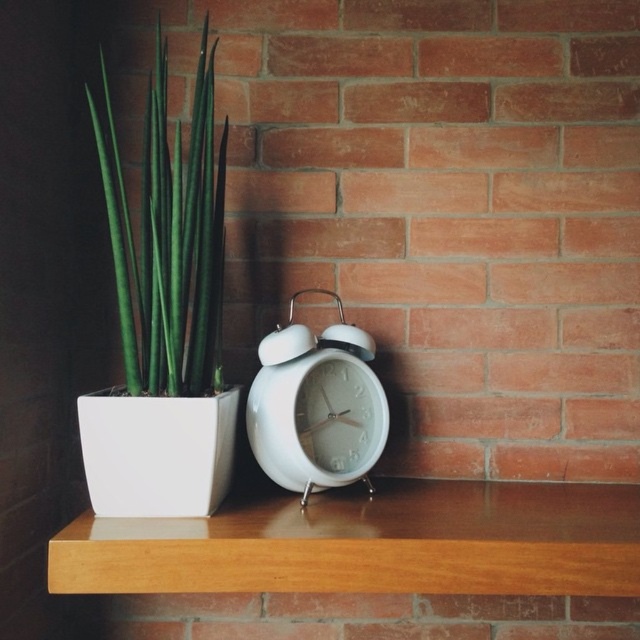
Question: Based on their relative distances, which object is nearer to the white glossy alarm clock at center?

Choices:
 (A) green glossy plant at left
 (B) wooden shelf at center

Answer: (B)

Question: Can you confirm if wooden shelf at center is positioned above white glossy alarm clock at center?

Choices:
 (A) no
 (B) yes

Answer: (A)

Question: Is green glossy plant at left to the right of white glossy alarm clock at center from the viewer's perspective?

Choices:
 (A) no
 (B) yes

Answer: (A)

Question: Which point is closer to the camera taking this photo?

Choices:
 (A) (372, 397)
 (B) (177, 232)
 (C) (509, 484)

Answer: (B)

Question: Is green glossy plant at left bigger than white glossy alarm clock at center?

Choices:
 (A) no
 (B) yes

Answer: (B)

Question: Which point is farther to the camera?

Choices:
 (A) white glossy alarm clock at center
 (B) wooden shelf at center

Answer: (A)